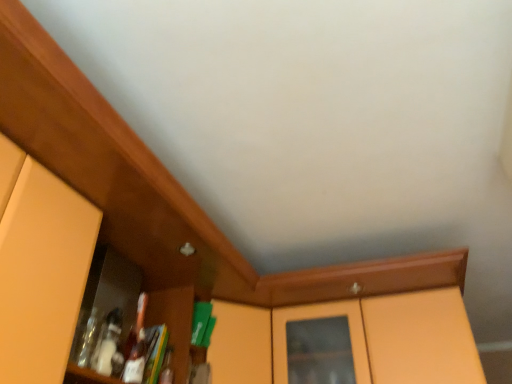
Question: Considering the relative positions of matte orange cabinet at left and matte orange cabinet at left in the image provided, is matte orange cabinet at left to the left or to the right of matte orange cabinet at left?

Choices:
 (A) right
 (B) left

Answer: (A)

Question: Considering their positions, is matte orange cabinet at left located in front of or behind matte orange cabinet at left?

Choices:
 (A) behind
 (B) front

Answer: (A)

Question: Estimate the real-world distances between objects in this image. Which object is closer to the matte orange cabinet at left?

Choices:
 (A) matte orange cabinet at left
 (B) matte orange cabinet at center

Answer: (A)

Question: Based on their relative distances, which object is nearer to the matte orange cabinet at left?

Choices:
 (A) matte orange cabinet at left
 (B) matte orange cabinet at center

Answer: (A)